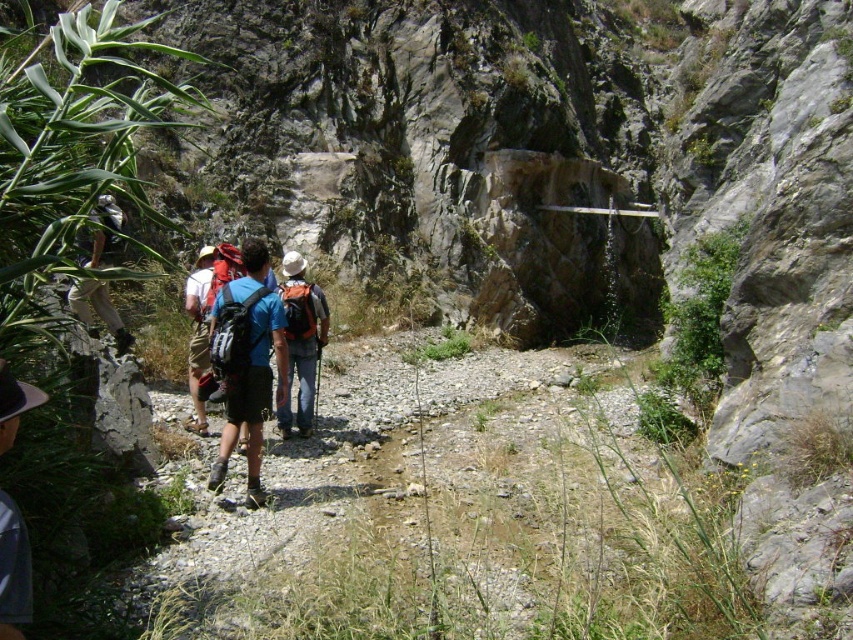
Is point (15, 429) closer to camera compared to point (100, 260)?

Yes, point (15, 429) is in front of point (100, 260).

Is point (4, 616) more distant than point (88, 317)?

No, it is in front of (88, 317).

What do you see at coordinates (13, 570) in the screenshot? I see `white felt hat at lower left` at bounding box center [13, 570].

Identify the location of white felt hat at lower left. This screenshot has height=640, width=853. (13, 570).

Does blue fabric backpack at center appear over matte gray backpack at center?

Yes, blue fabric backpack at center is above matte gray backpack at center.

Does blue fabric backpack at center have a lesser height compared to matte gray backpack at center?

Incorrect, blue fabric backpack at center's height does not fall short of matte gray backpack at center's.

The width and height of the screenshot is (853, 640). In order to click on blue fabric backpack at center in this screenshot , I will do `click(247, 362)`.

Can you confirm if matte khaki shorts at left is positioned above matte blue shirt at center?

Yes.

Is matte khaki shorts at left thinner than matte blue shirt at center?

In fact, matte khaki shorts at left might be wider than matte blue shirt at center.

Image resolution: width=853 pixels, height=640 pixels. Find the location of `matte khaki shorts at left`. matte khaki shorts at left is located at coordinates (97, 310).